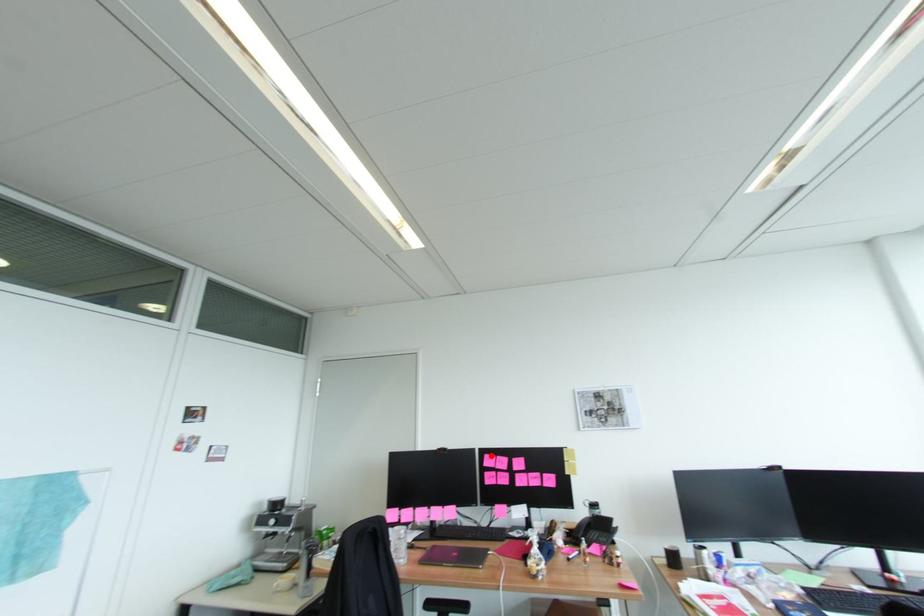
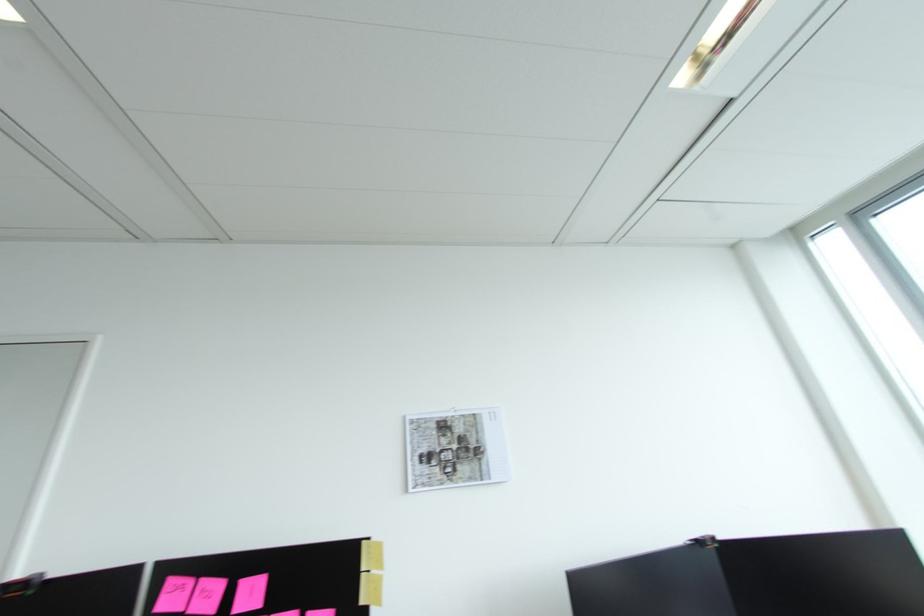
Question: A red point is marked in image1. In image2, is the corresponding 3D point closer to the camera or farther? Reply with the corresponding letter.

Choices:
 (A) The corresponding 3D point is closer.
 (B) The corresponding 3D point is farther.

Answer: (A)